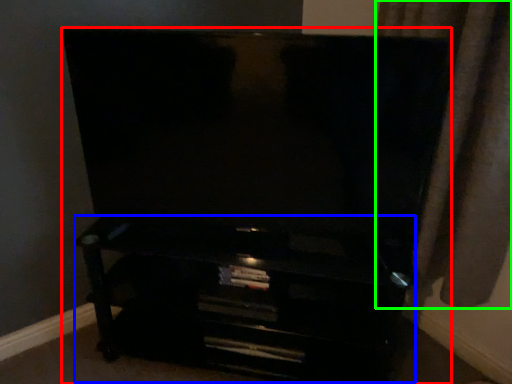
Question: Which object is positioned closest to furniture (highlighted by a red box)? Select from entertainment center (highlighted by a blue box) and curtain (highlighted by a green box).

Choices:
 (A) entertainment center
 (B) curtain

Answer: (A)